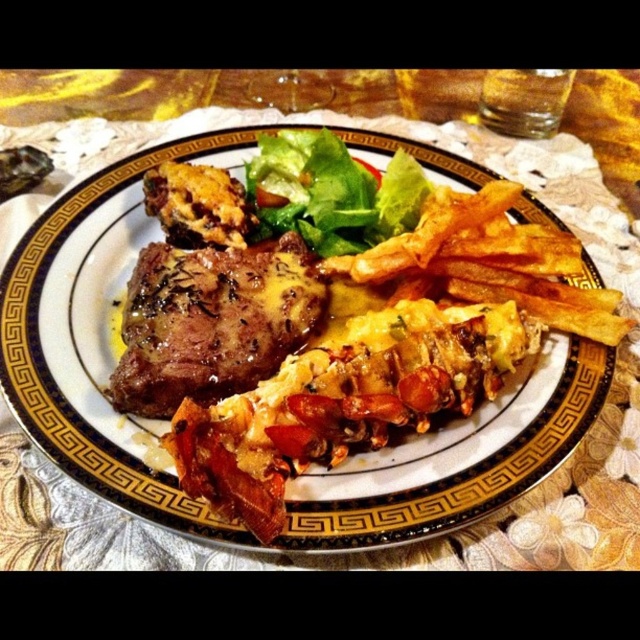
Question: Is golden-brown crispy fries at upper right above savory brown steak at upper left?

Choices:
 (A) yes
 (B) no

Answer: (A)

Question: Among these points, which one is farthest from the camera?

Choices:
 (A) (228, 364)
 (B) (298, 168)

Answer: (B)

Question: Is golden-brown crispy fries at upper right to the right of savory brown steak at upper left from the viewer's perspective?

Choices:
 (A) no
 (B) yes

Answer: (B)

Question: Which of the following is the closest to the observer?

Choices:
 (A) golden-brown crispy fries at upper right
 (B) savory brown steak at upper left
 (C) green leafy lettuce at center

Answer: (A)

Question: Which object is closer to the camera taking this photo?

Choices:
 (A) green leafy lettuce at center
 (B) savory brown steak at upper left

Answer: (B)

Question: Does golden-brown crispy fries at upper right have a lesser width compared to savory brown steak at upper left?

Choices:
 (A) yes
 (B) no

Answer: (B)